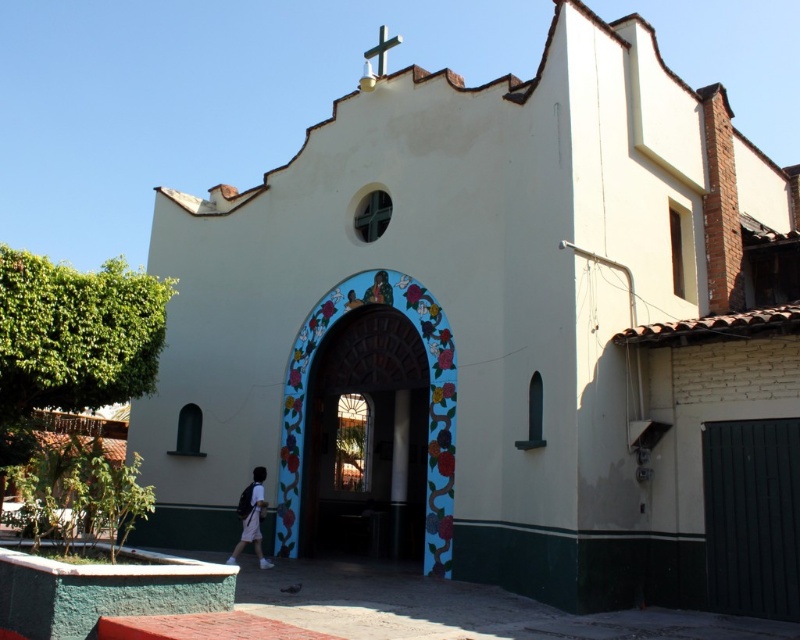
Is white fabric backpack at center to the left of green metallic cross at upper center from the viewer's perspective?

Correct, you'll find white fabric backpack at center to the left of green metallic cross at upper center.

Does white fabric backpack at center have a greater height compared to green metallic cross at upper center?

In fact, white fabric backpack at center may be shorter than green metallic cross at upper center.

Where is `white fabric backpack at center`? Image resolution: width=800 pixels, height=640 pixels. white fabric backpack at center is located at coordinates (252, 516).

Identify the location of white fabric backpack at center. (252, 516).

Does painted brick archway at center appear over white fabric backpack at center?

→ Correct, painted brick archway at center is located above white fabric backpack at center.

Can you confirm if painted brick archway at center is shorter than white fabric backpack at center?

Incorrect, painted brick archway at center's height does not fall short of white fabric backpack at center's.

This screenshot has width=800, height=640. Describe the element at coordinates (366, 440) in the screenshot. I see `painted brick archway at center` at that location.

Locate an element on the screen. This screenshot has height=640, width=800. painted brick archway at center is located at coordinates (366, 440).

Is dark green wooden gate at lower right wider than green metallic cross at upper center?

Incorrect, dark green wooden gate at lower right's width does not surpass green metallic cross at upper center's.

Is dark green wooden gate at lower right bigger than green metallic cross at upper center?

No.

Between point (716, 486) and point (384, 49), which one is positioned behind?

Point (384, 49)

This screenshot has height=640, width=800. Find the location of `dark green wooden gate at lower right`. dark green wooden gate at lower right is located at coordinates (752, 516).